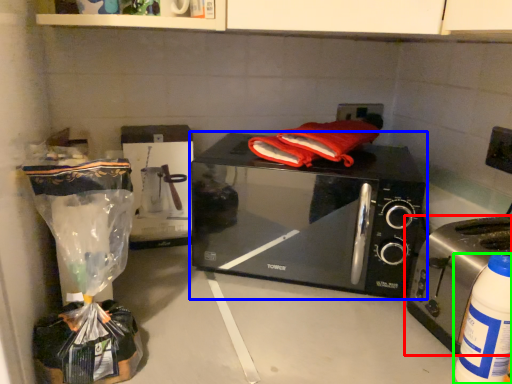
Question: Which object is positioned farthest from toaster (highlighted by a red box)? Select from microwave oven (highlighted by a blue box) and bottle (highlighted by a green box).

Choices:
 (A) microwave oven
 (B) bottle

Answer: (A)